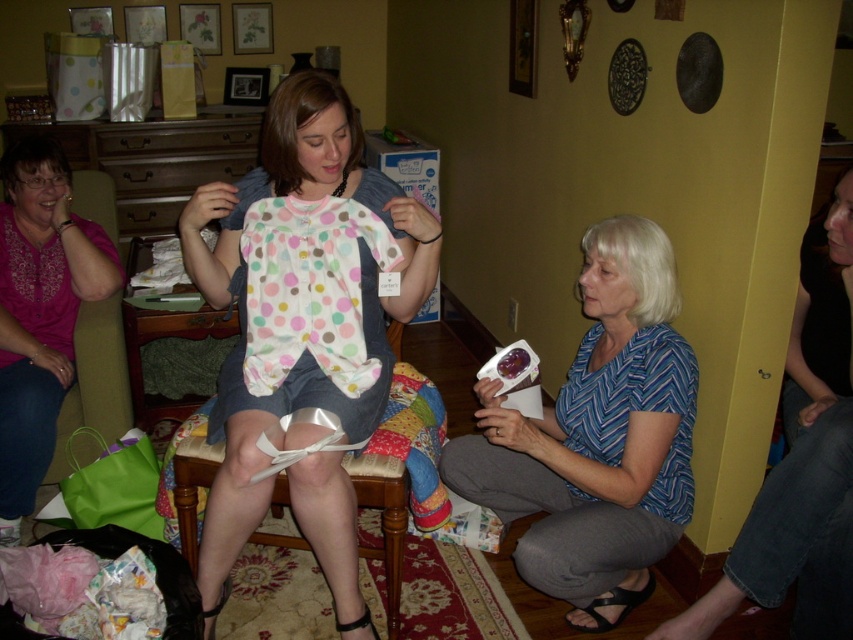
Which is behind, point (486, 419) or point (84, 253)?

The point (84, 253) is more distant.

This screenshot has width=853, height=640. In order to click on blue striped shirt at lower right in this screenshot , I will do `click(596, 436)`.

The height and width of the screenshot is (640, 853). I want to click on blue striped shirt at lower right, so click(x=596, y=436).

Does matte polka dot onesie at center appear on the left side of blue chevron shirt at lower right?

Yes, matte polka dot onesie at center is to the left of blue chevron shirt at lower right.

Can you confirm if matte polka dot onesie at center is wider than blue chevron shirt at lower right?

Indeed, matte polka dot onesie at center has a greater width compared to blue chevron shirt at lower right.

At what (x,y) coordinates should I click in order to perform the action: click on matte polka dot onesie at center. Please return your answer as a coordinate pair (x, y). This screenshot has height=640, width=853. Looking at the image, I should click on (305, 348).

This screenshot has width=853, height=640. Identify the location of matte polka dot onesie at center. (305, 348).

Who is lower down, matte polka dot onesie at center or pink embroidered blouse at upper left?

matte polka dot onesie at center is lower down.

Between matte polka dot onesie at center and pink embroidered blouse at upper left, which one appears on the right side from the viewer's perspective?

matte polka dot onesie at center

Which is in front, point (291, 324) or point (68, 282)?

Point (291, 324) is more forward.

Where is `matte polka dot onesie at center`? This screenshot has height=640, width=853. matte polka dot onesie at center is located at coordinates (305, 348).